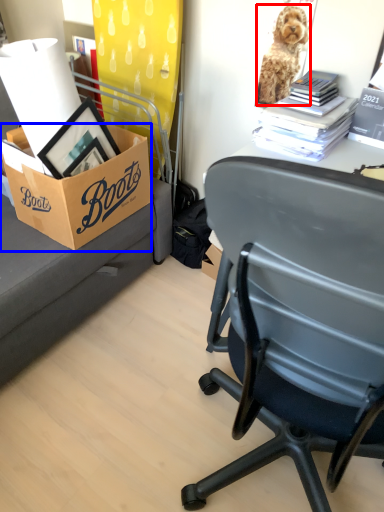
Question: Which object appears closest to the camera in this image, dog (highlighted by a red box) or box (highlighted by a blue box)?

Choices:
 (A) dog
 (B) box

Answer: (B)